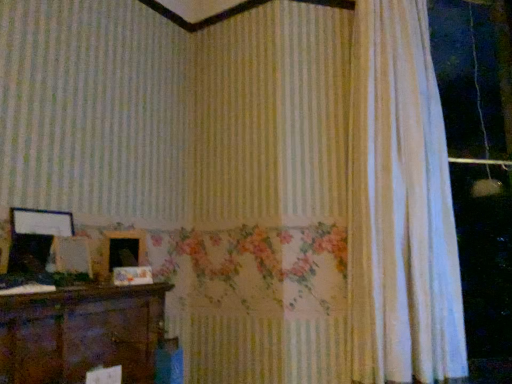
What do you see at coordinates (35, 237) in the screenshot? The width and height of the screenshot is (512, 384). I see `wooden picture frame at left, which appears as the 2th picture frame when viewed from the right` at bounding box center [35, 237].

In order to face white sheer curtain at right, should I rotate leftwards or rightwards?

You should look right and rotate roughly 19.370 degrees.

Find the location of a particular element. wooden picture frame at center, the 1th picture frame from the right is located at coordinates (124, 249).

Based on the photo, is wooden picture frame at center, positioned as the 2th picture frame in left-to-right order, positioned far away from wooden picture frame at left, acting as the 1th picture frame starting from the left?

wooden picture frame at center, positioned as the 2th picture frame in left-to-right order, is actually quite close to wooden picture frame at left, acting as the 1th picture frame starting from the left.

Can you confirm if wooden picture frame at center, positioned as the 2th picture frame in left-to-right order, is wider than wooden picture frame at left, acting as the 1th picture frame starting from the left?

Yes.

From the image's perspective, between wooden picture frame at center, the 1th picture frame from the right, and wooden picture frame at left, acting as the 1th picture frame starting from the left, who is located below?

From the image's view, wooden picture frame at center, the 1th picture frame from the right, is below.

Is wooden picture frame at center, the 1th picture frame from the right, facing away from wooden picture frame at left, which appears as the 2th picture frame when viewed from the right?

No, wooden picture frame at center, the 1th picture frame from the right,'s orientation is not away from wooden picture frame at left, which appears as the 2th picture frame when viewed from the right.

Is wooden picture frame at left, acting as the 1th picture frame starting from the left, beside wooden picture frame at center, positioned as the 2th picture frame in left-to-right order?

They are not placed beside each other.

Which object is more forward, wooden picture frame at left, acting as the 1th picture frame starting from the left, or wooden picture frame at center, positioned as the 2th picture frame in left-to-right order?

wooden picture frame at left, acting as the 1th picture frame starting from the left, is more forward.

Is wooden picture frame at center, positioned as the 2th picture frame in left-to-right order, inside wooden picture frame at left, which appears as the 2th picture frame when viewed from the right?

That's incorrect, wooden picture frame at center, positioned as the 2th picture frame in left-to-right order, is not inside wooden picture frame at left, which appears as the 2th picture frame when viewed from the right.

From the image's perspective, is white sheer curtain at right located above or below wooden picture frame at center, the 1th picture frame from the right?

white sheer curtain at right is situated higher than wooden picture frame at center, the 1th picture frame from the right, in the image.

Is wooden picture frame at center, the 1th picture frame from the right, a part of white sheer curtain at right?

No, wooden picture frame at center, the 1th picture frame from the right, is not surrounded by white sheer curtain at right.

From a real-world perspective, who is located higher, white sheer curtain at right or wooden picture frame at center, positioned as the 2th picture frame in left-to-right order?

white sheer curtain at right.

Which of these two, white sheer curtain at right or wooden picture frame at center, the 1th picture frame from the right, stands taller?

white sheer curtain at right.

From the image's perspective, is white sheer curtain at right below wooden picture frame at left, which appears as the 2th picture frame when viewed from the right?

No, from the image's perspective, white sheer curtain at right is not beneath wooden picture frame at left, which appears as the 2th picture frame when viewed from the right.

Does white sheer curtain at right have a lesser width compared to wooden picture frame at left, acting as the 1th picture frame starting from the left?

No.

Does white sheer curtain at right touch wooden picture frame at left, acting as the 1th picture frame starting from the left?

white sheer curtain at right is not next to wooden picture frame at left, acting as the 1th picture frame starting from the left, and they're not touching.

From a real-world perspective, is white sheer curtain at right over wooden picture frame at left, which appears as the 2th picture frame when viewed from the right?

Yes, from a real-world perspective, white sheer curtain at right is above wooden picture frame at left, which appears as the 2th picture frame when viewed from the right.

Is wooden picture frame at center, the 1th picture frame from the right, thinner than white sheer curtain at right?

Indeed, wooden picture frame at center, the 1th picture frame from the right, has a lesser width compared to white sheer curtain at right.

From a real-world perspective, is wooden picture frame at center, the 1th picture frame from the right, on top of white sheer curtain at right?

Actually, wooden picture frame at center, the 1th picture frame from the right, is physically below white sheer curtain at right in the real world.

Is wooden picture frame at center, positioned as the 2th picture frame in left-to-right order, positioned far away from white sheer curtain at right?

That's right, there is a large distance between wooden picture frame at center, positioned as the 2th picture frame in left-to-right order, and white sheer curtain at right.

How distant is wooden picture frame at center, the 1th picture frame from the right, from white sheer curtain at right?

wooden picture frame at center, the 1th picture frame from the right, and white sheer curtain at right are 1.38 meters apart from each other.

Considering the relative sizes of wooden picture frame at left, which appears as the 2th picture frame when viewed from the right, and white sheer curtain at right in the image provided, is wooden picture frame at left, which appears as the 2th picture frame when viewed from the right, taller than white sheer curtain at right?

No, wooden picture frame at left, which appears as the 2th picture frame when viewed from the right, is not taller than white sheer curtain at right.

How much distance is there between wooden picture frame at left, acting as the 1th picture frame starting from the left, and white sheer curtain at right?

wooden picture frame at left, acting as the 1th picture frame starting from the left, and white sheer curtain at right are 1.62 meters apart.

Who is bigger, wooden picture frame at left, acting as the 1th picture frame starting from the left, or white sheer curtain at right?

white sheer curtain at right is bigger.

Are wooden picture frame at left, acting as the 1th picture frame starting from the left, and white sheer curtain at right far apart?

Yes.

You are a GUI agent. You are given a task and a screenshot of the screen. Output one action in this format:
    pyautogui.click(x=<x>, y=<y>)
    Task: Click on the picture frame located above the wooden picture frame at center, positioned as the 2th picture frame in left-to-right order (from the image's perspective)
    The width and height of the screenshot is (512, 384).
    Given the screenshot: What is the action you would take?
    pyautogui.click(x=35, y=237)

Find the location of `picture frame below the wooden picture frame at left, which appears as the 2th picture frame when viewed from the right (from a real-world perspective)`. picture frame below the wooden picture frame at left, which appears as the 2th picture frame when viewed from the right (from a real-world perspective) is located at coordinates (124, 249).

From the image, which object appears to be nearer to wooden picture frame at left, acting as the 1th picture frame starting from the left, wooden picture frame at center, the 1th picture frame from the right, or white sheer curtain at right?

Based on the image, wooden picture frame at center, the 1th picture frame from the right, appears to be nearer to wooden picture frame at left, acting as the 1th picture frame starting from the left.

From the image, which object appears to be nearer to wooden picture frame at center, the 1th picture frame from the right, wooden picture frame at left, which appears as the 2th picture frame when viewed from the right, or white sheer curtain at right?

The object closer to wooden picture frame at center, the 1th picture frame from the right, is wooden picture frame at left, which appears as the 2th picture frame when viewed from the right.

Based on their spatial positions, is wooden picture frame at center, the 1th picture frame from the right, or wooden picture frame at left, acting as the 1th picture frame starting from the left, closer to white sheer curtain at right?

wooden picture frame at center, the 1th picture frame from the right, is closer to white sheer curtain at right.

Estimate the real-world distances between objects in this image. Which object is closer to wooden picture frame at left, which appears as the 2th picture frame when viewed from the right, white sheer curtain at right or wooden picture frame at center, positioned as the 2th picture frame in left-to-right order?

Based on the image, wooden picture frame at center, positioned as the 2th picture frame in left-to-right order, appears to be nearer to wooden picture frame at left, which appears as the 2th picture frame when viewed from the right.

Based on their spatial positions, is wooden picture frame at left, which appears as the 2th picture frame when viewed from the right, or wooden picture frame at center, the 1th picture frame from the right, closer to white sheer curtain at right?

wooden picture frame at center, the 1th picture frame from the right, is positioned closer to the anchor white sheer curtain at right.

From the image, which object appears to be farther from wooden picture frame at center, positioned as the 2th picture frame in left-to-right order, white sheer curtain at right or wooden picture frame at left, which appears as the 2th picture frame when viewed from the right?

Based on the image, white sheer curtain at right appears to be further to wooden picture frame at center, positioned as the 2th picture frame in left-to-right order.

You are a GUI agent. You are given a task and a screenshot of the screen. Output one action in this format:
    pyautogui.click(x=<x>, y=<y>)
    Task: Click on the picture frame located between wooden picture frame at left, acting as the 1th picture frame starting from the left, and white sheer curtain at right in the left-right direction
    
    Given the screenshot: What is the action you would take?
    pyautogui.click(x=124, y=249)